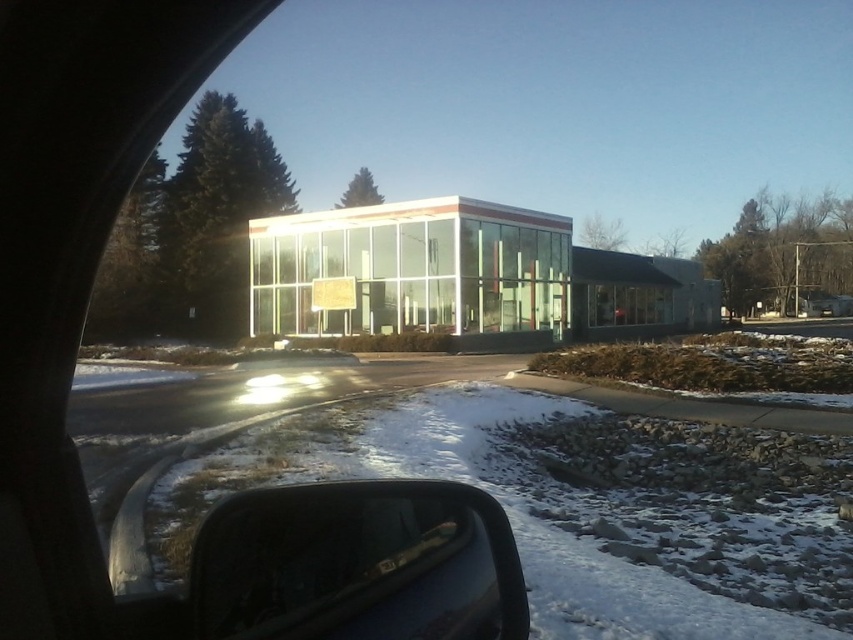
In the scene shown: Which of these two, white powdery snow at lower left or transparent glass side mirror at lower left, stands shorter?

white powdery snow at lower left

At what (x,y) coordinates should I click in order to perform the action: click on white powdery snow at lower left. Please return your answer as a coordinate pair (x, y). Looking at the image, I should click on (555, 518).

What do you see at coordinates (555, 518) in the screenshot?
I see `white powdery snow at lower left` at bounding box center [555, 518].

Where is `white powdery snow at lower left`? The height and width of the screenshot is (640, 853). white powdery snow at lower left is located at coordinates (555, 518).